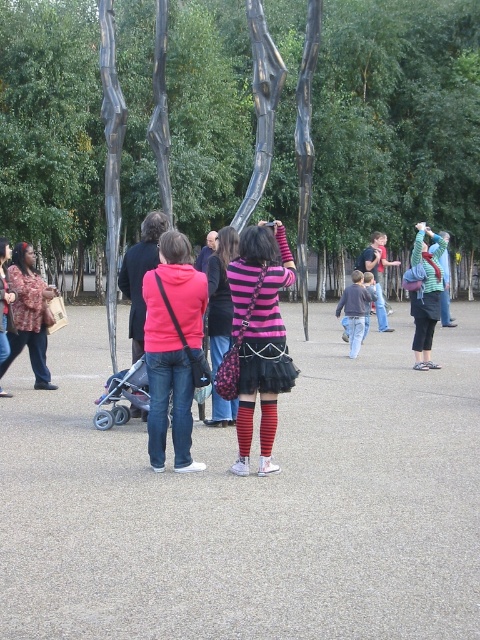
Can you confirm if printed fabric shirt at left is smaller than gray plastic baby carriage at lower left?

No, printed fabric shirt at left is not smaller than gray plastic baby carriage at lower left.

Does point (24, 246) come in front of point (132, 406)?

No, it is behind (132, 406).

You are a GUI agent. You are given a task and a screenshot of the screen. Output one action in this format:
    pyautogui.click(x=<x>, y=<y>)
    Task: Click on the printed fabric shirt at left
    
    Given the screenshot: What is the action you would take?
    28,314

Locate an element on the screen. printed fabric shirt at left is located at coordinates (28, 314).

Between pink striped sweater at center and gray plastic baby carriage at lower left, which one appears on the left side from the viewer's perspective?

Positioned to the left is gray plastic baby carriage at lower left.

Is pink striped sweater at center behind gray plastic baby carriage at lower left?

No, pink striped sweater at center is in front of gray plastic baby carriage at lower left.

Who is more distant from viewer, (252, 339) or (106, 420)?

Point (106, 420)

I want to click on pink striped sweater at center, so click(x=261, y=337).

Is point (286, 365) positioned in front of point (210, 333)?

That is True.

Is pink striped sweater at center taller than striped knit sweater at center?

Yes, pink striped sweater at center is taller than striped knit sweater at center.

Image resolution: width=480 pixels, height=640 pixels. What do you see at coordinates (261, 337) in the screenshot? I see `pink striped sweater at center` at bounding box center [261, 337].

Where is `pink striped sweater at center`? The image size is (480, 640). pink striped sweater at center is located at coordinates (261, 337).